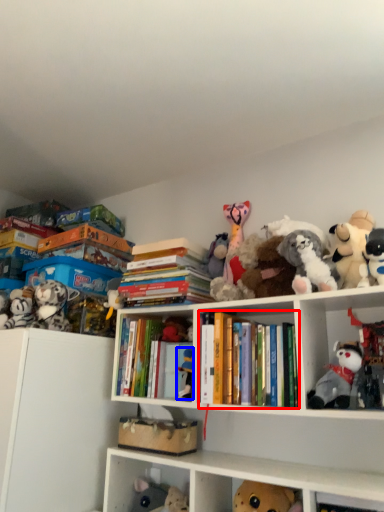
Question: Which of the following is the closest to the observer, book (highlighted by a red box) or toy (highlighted by a blue box)?

Choices:
 (A) book
 (B) toy

Answer: (A)